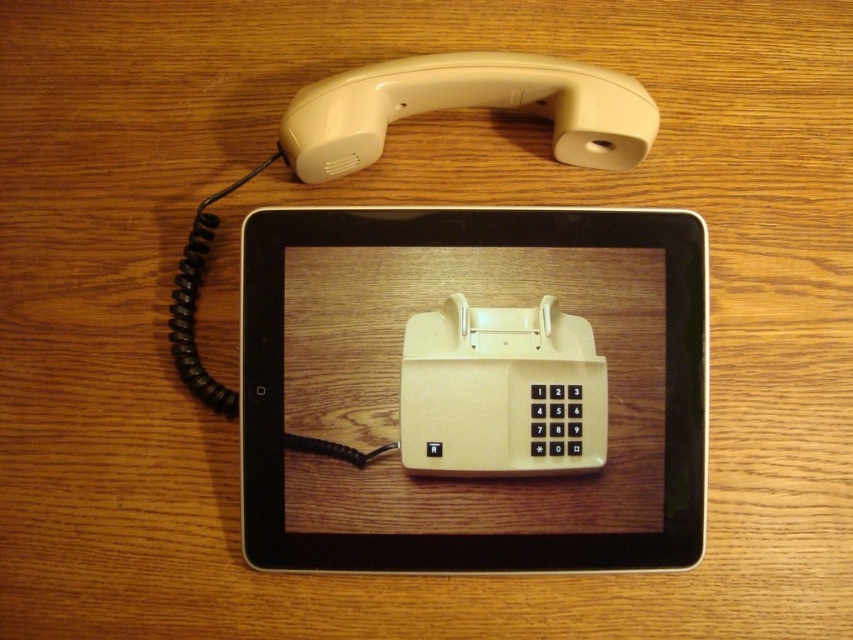
Question: Is beige plastic tablet at center wider than beige plastic phone at center?

Choices:
 (A) no
 (B) yes

Answer: (B)

Question: In this image, where is beige plastic tablet at center located relative to beige plastic phone at center?

Choices:
 (A) below
 (B) above

Answer: (A)

Question: Among these objects, which one is farthest from the camera?

Choices:
 (A) beige plastic tablet at center
 (B) beige plastic phone at center

Answer: (B)

Question: From the image, what is the correct spatial relationship of beige plastic tablet at center in relation to beige plastic phone at center?

Choices:
 (A) left
 (B) right

Answer: (A)

Question: Which point is farther to the camera?

Choices:
 (A) beige plastic phone at center
 (B) beige plastic tablet at center

Answer: (A)